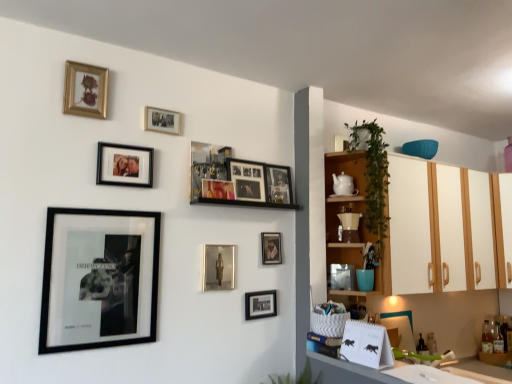
Question: Does metallic silver picture frame at upper center, the 1th picture frame positioned from the right, have a lesser height compared to white glossy cabinet at right, which is counted as the 1th cabinetry, starting from the left?

Choices:
 (A) no
 (B) yes

Answer: (B)

Question: Can you confirm if metallic silver picture frame at upper center, the 1th picture frame positioned from the right, is smaller than white glossy cabinet at right, which is counted as the 1th cabinetry, starting from the left?

Choices:
 (A) yes
 (B) no

Answer: (A)

Question: From a real-world perspective, is metallic silver picture frame at upper center, the 1th picture frame positioned from the right, on top of white glossy cabinet at right, which is counted as the 1th cabinetry, starting from the left?

Choices:
 (A) yes
 (B) no

Answer: (A)

Question: Is metallic silver picture frame at upper center, the 1th picture frame positioned from the right, aimed at white glossy cabinet at right, arranged as the 2th cabinetry when viewed from the right?

Choices:
 (A) yes
 (B) no

Answer: (B)

Question: Is white glossy cabinet at right, which is counted as the 1th cabinetry, starting from the left, inside metallic silver picture frame at upper center, which appears as the eleventh picture frame when viewed from the left?

Choices:
 (A) no
 (B) yes

Answer: (A)

Question: Considering the relative sizes of metallic silver picture frame at upper center, the 1th picture frame positioned from the right, and white glossy cabinet at right, which is counted as the 1th cabinetry, starting from the left, in the image provided, is metallic silver picture frame at upper center, the 1th picture frame positioned from the right, bigger than white glossy cabinet at right, which is counted as the 1th cabinetry, starting from the left,?

Choices:
 (A) yes
 (B) no

Answer: (B)

Question: Is there a large distance between matte black picture frame at lower center, the 3th picture frame positioned from the right, and gold-framed photo at upper center, the 8th picture frame in the right-to-left sequence?

Choices:
 (A) yes
 (B) no

Answer: (B)

Question: Can you confirm if matte black picture frame at lower center, the 3th picture frame positioned from the right, is taller than gold-framed photo at upper center, the 8th picture frame in the right-to-left sequence?

Choices:
 (A) yes
 (B) no

Answer: (A)

Question: Can gold-framed photo at upper center, the 8th picture frame in the right-to-left sequence, be found inside matte black picture frame at lower center, which appears as the 9th picture frame when viewed from the left?

Choices:
 (A) yes
 (B) no

Answer: (B)

Question: Considering the relative sizes of matte black picture frame at lower center, which appears as the 9th picture frame when viewed from the left, and gold-framed photo at upper center, marked as the 4th picture frame in a left-to-right arrangement, in the image provided, is matte black picture frame at lower center, which appears as the 9th picture frame when viewed from the left, shorter than gold-framed photo at upper center, marked as the 4th picture frame in a left-to-right arrangement,?

Choices:
 (A) yes
 (B) no

Answer: (B)

Question: From the image's perspective, does matte black picture frame at lower center, the 3th picture frame positioned from the right, appear lower than gold-framed photo at upper center, the 8th picture frame in the right-to-left sequence?

Choices:
 (A) no
 (B) yes

Answer: (B)

Question: Is matte black picture frame at lower center, which appears as the 9th picture frame when viewed from the left, wider than gold-framed photo at upper center, marked as the 4th picture frame in a left-to-right arrangement?

Choices:
 (A) yes
 (B) no

Answer: (B)

Question: Can you confirm if green leafy plant at lower center, the 2th plant from the top, is thinner than matte black picture frame at center, which is the 10th picture frame in left-to-right order?

Choices:
 (A) no
 (B) yes

Answer: (A)